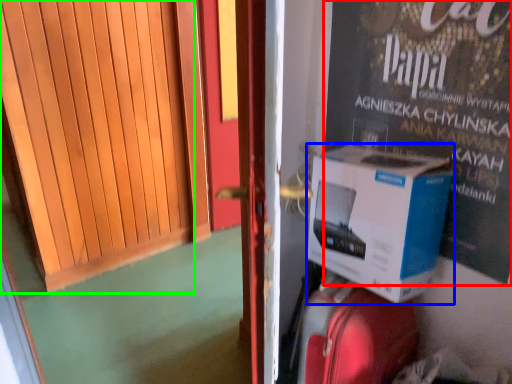
Question: Which object is positioned farthest from advertisement (highlighted by a red box)? Select from box (highlighted by a blue box) and door (highlighted by a green box).

Choices:
 (A) box
 (B) door

Answer: (B)